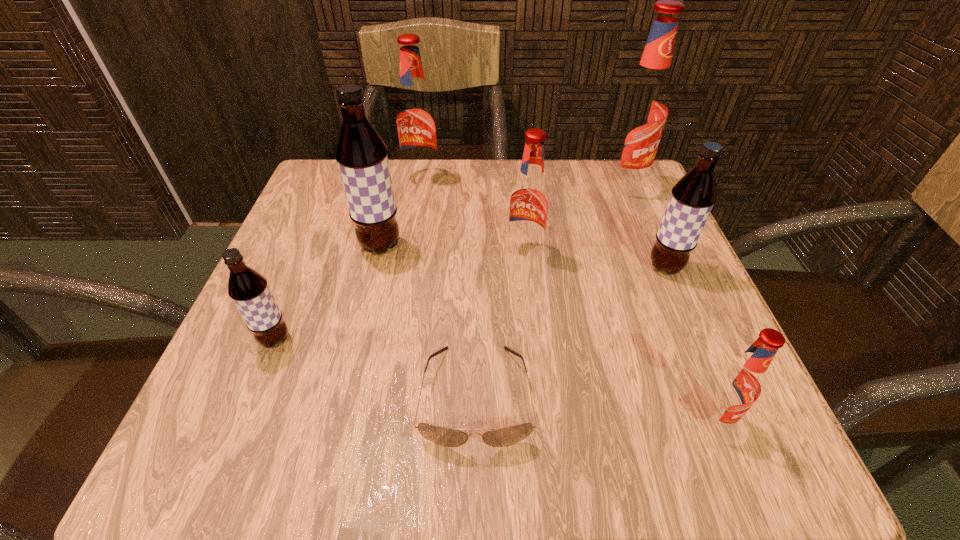
Image resolution: width=960 pixels, height=540 pixels. In order to click on the biggest red root beer in this screenshot , I will do `click(641, 113)`.

Where is `the tallest object`? the tallest object is located at coordinates (641, 113).

Find the location of a particular element. the leftmost red root beer is located at coordinates (416, 118).

I want to click on the biggest brown root beer, so click(361, 155).

Identify the location of the third farthest red root beer. This screenshot has height=540, width=960. (529, 200).

Where is `the fourth root beer from right to left`? the fourth root beer from right to left is located at coordinates (529, 200).

The image size is (960, 540). Find the location of `the second biggest brown root beer`. the second biggest brown root beer is located at coordinates tap(693, 196).

You are a GUI agent. You are given a task and a screenshot of the screen. Output one action in this format:
    pyautogui.click(x=<x>, y=<y>)
    Task: Click on the leftmost brown root beer
    This screenshot has width=960, height=540.
    Given the screenshot: What is the action you would take?
    pyautogui.click(x=249, y=290)

Where is `the nearest brown root beer`? The image size is (960, 540). the nearest brown root beer is located at coordinates (249, 290).

Where is `the smallest red root beer`? This screenshot has width=960, height=540. the smallest red root beer is located at coordinates (738, 384).